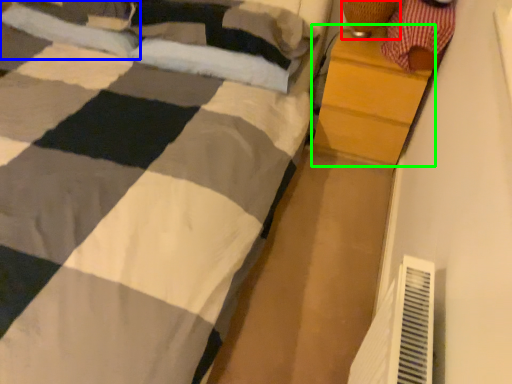
Question: Which object is the closest to the lamp (highlighted by a red box)? Choose among these: pillow (highlighted by a blue box) or chest of drawers (highlighted by a green box).

Choices:
 (A) pillow
 (B) chest of drawers

Answer: (B)